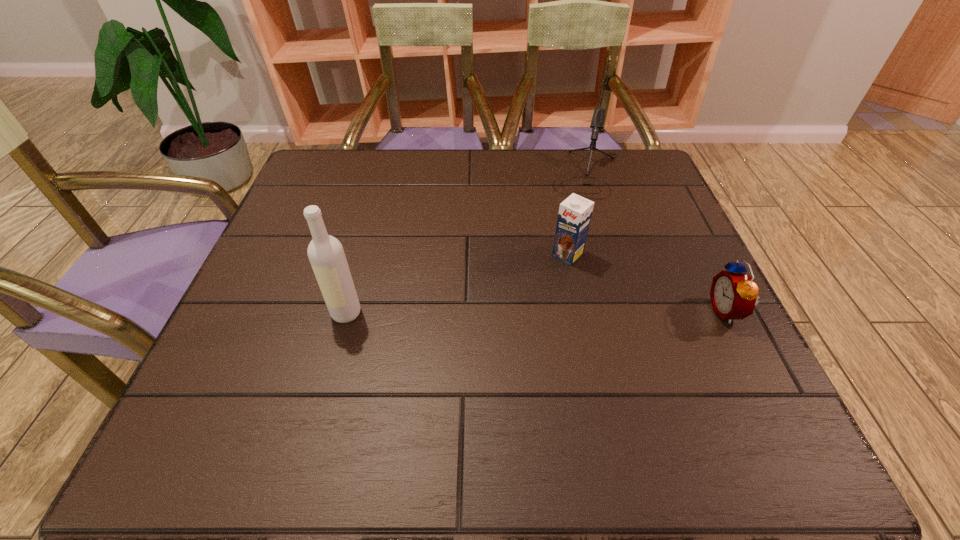
Identify the location of vacant area between the rightmost object and the microphone. (656, 242).

Locate an element on the screen. The image size is (960, 540). free space between the microphone and the tallest object is located at coordinates (466, 244).

You are a GUI agent. You are given a task and a screenshot of the screen. Output one action in this format:
    pyautogui.click(x=<x>, y=<y>)
    Task: Click on the free space between the rightmost object and the third nearest object
    This screenshot has width=960, height=540.
    Given the screenshot: What is the action you would take?
    pyautogui.click(x=647, y=283)

You are a GUI agent. You are given a task and a screenshot of the screen. Output one action in this format:
    pyautogui.click(x=<x>, y=<y>)
    Task: Click on the blank region between the alarm clock and the farthest object
    The height and width of the screenshot is (540, 960).
    Given the screenshot: What is the action you would take?
    pyautogui.click(x=656, y=242)

This screenshot has height=540, width=960. I want to click on empty space that is in between the alarm clock and the second farthest object, so click(647, 283).

Select which object is the second closest to the tallest object. Please provide its 2D coordinates. Your answer should be formatted as a tuple, i.e. [(x, y)], where the tuple contains the x and y coordinates of a point satisfying the conditions above.

[(597, 122)]

Where is `the third closest object to the alarm clock`? the third closest object to the alarm clock is located at coordinates (326, 254).

The image size is (960, 540). I want to click on vacant area that satisfies the following two spatial constraints: 1. on the front side of the alarm clock; 2. on the front-facing side of the third nearest object, so [579, 311].

At what (x,y) coordinates should I click in order to perform the action: click on vacant point that satisfies the following two spatial constraints: 1. on the back side of the tallest object; 2. on the right side of the farthest object. Please return your answer as a coordinate pair (x, y). Looking at the image, I should click on (384, 174).

The height and width of the screenshot is (540, 960). What are the coordinates of `vacant space that satisfies the following two spatial constraints: 1. on the front side of the alarm clock; 2. on the front-facing side of the chocolate milk` in the screenshot? It's located at (579, 311).